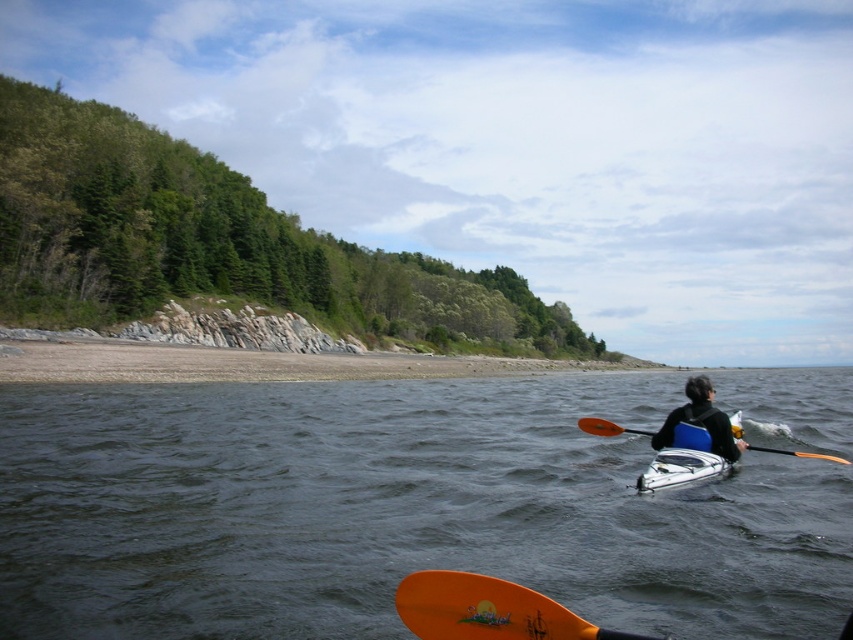
You are a photographer trying to capture the orange matte paddle at lower center and the brown sand at lower left in the same frame. Which object will appear bigger in your photo?

The brown sand at lower left will appear bigger in the photo because it has a larger size compared to the orange matte paddle at lower center.

You are standing on the shore and see the brown sand at lower left and the orange matte paddle at lower center in the water. Which object is wider?

The brown sand at lower left is wider than the orange matte paddle at lower center.